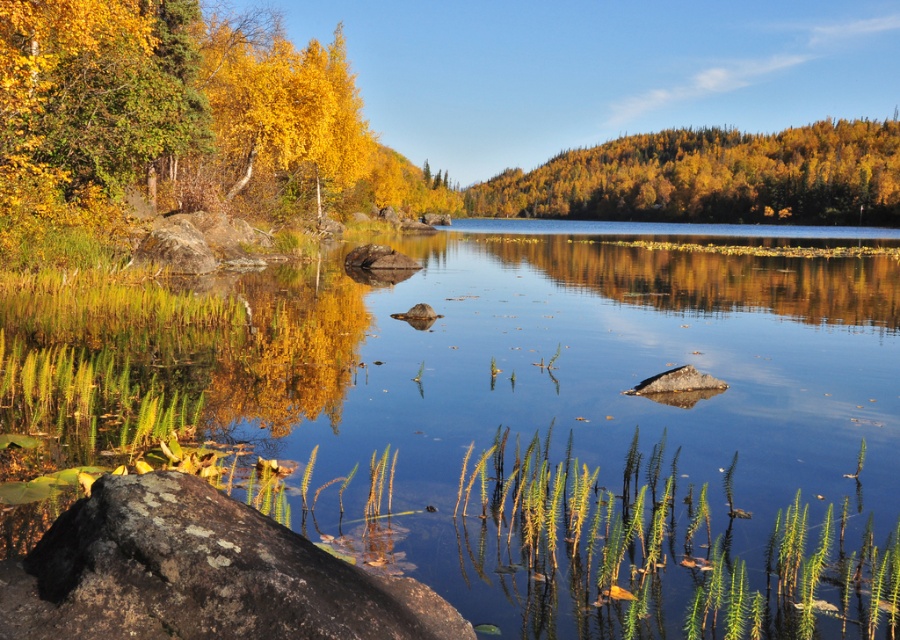
Is point (479, 449) positioned after point (648, 196)?

No, (479, 449) is closer to viewer.

Based on the photo, which is more to the left, clear water at center or golden textured hillside at upper right?

clear water at center

This screenshot has height=640, width=900. Describe the element at coordinates (522, 419) in the screenshot. I see `clear water at center` at that location.

Find the location of a particular element. clear water at center is located at coordinates pos(522,419).

Does rusty stone at lower left come in front of golden textured hillside at upper right?

Yes, it is.

Which is more to the left, rusty stone at lower left or golden textured hillside at upper right?

rusty stone at lower left is more to the left.

Where is `rusty stone at lower left`? rusty stone at lower left is located at coordinates (200, 573).

The width and height of the screenshot is (900, 640). Identify the location of rusty stone at lower left. (200, 573).

Between clear water at center and rusty stone at lower left, which one has less height?

With less height is rusty stone at lower left.

Who is positioned more to the left, clear water at center or rusty stone at lower left?

rusty stone at lower left is more to the left.

Is point (552, 433) more distant than point (83, 628)?

Yes, point (552, 433) is behind point (83, 628).

This screenshot has width=900, height=640. Identify the location of clear water at center. (522, 419).